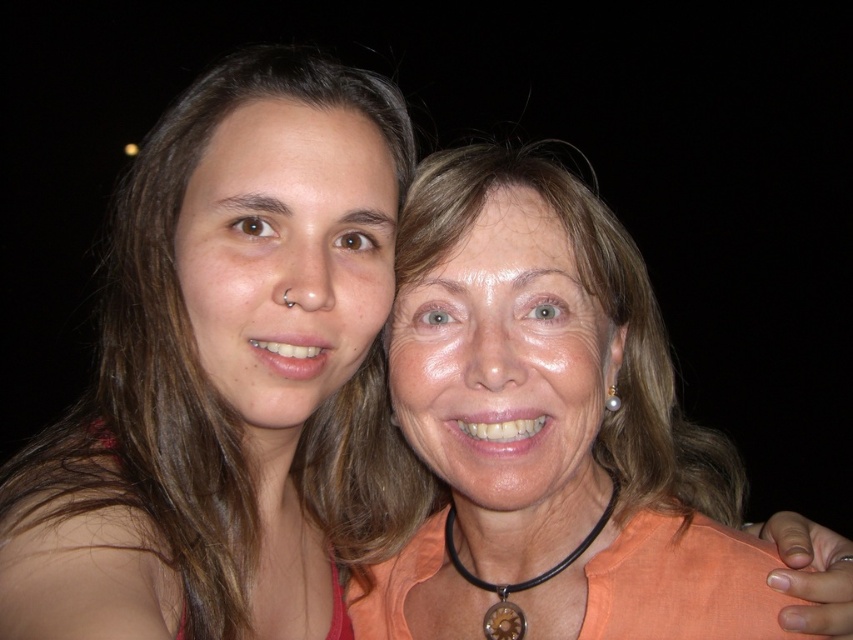
Question: Can you confirm if matte orange blouse at center is thinner than black leather necklace at center?

Choices:
 (A) no
 (B) yes

Answer: (A)

Question: Which point is closer to the camera?

Choices:
 (A) (602, 520)
 (B) (422, 253)

Answer: (B)

Question: Is matte orange blouse at center wider than black leather necklace at center?

Choices:
 (A) yes
 (B) no

Answer: (A)

Question: Considering the relative positions of matte orange blouse at center and black leather necklace at center in the image provided, where is matte orange blouse at center located with respect to black leather necklace at center?

Choices:
 (A) below
 (B) above

Answer: (A)

Question: Among these points, which one is nearest to the camera?

Choices:
 (A) (490, 611)
 (B) (653, 432)

Answer: (A)